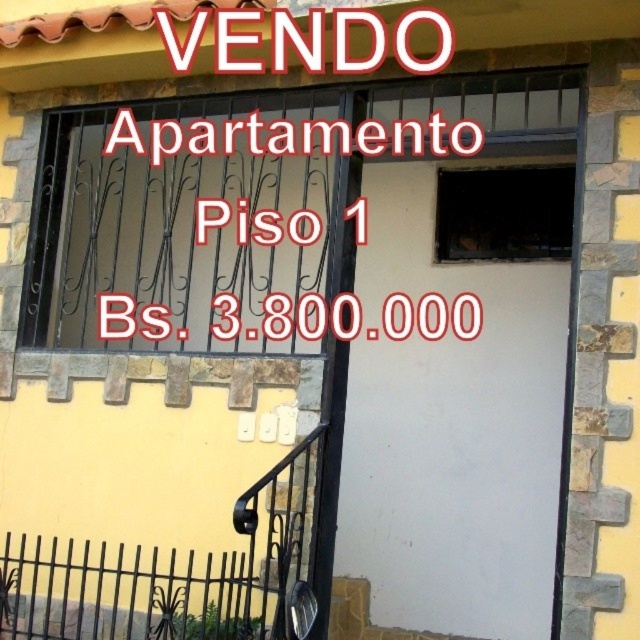
Question: Where is white matte door at center located in relation to white matte sign at upper center in the image?

Choices:
 (A) left
 (B) right

Answer: (B)

Question: Which point is farther to the camera?

Choices:
 (A) (444, 467)
 (B) (262, 60)

Answer: (A)

Question: Is white matte door at center to the left of white matte sign at upper center from the viewer's perspective?

Choices:
 (A) yes
 (B) no

Answer: (B)

Question: Can you confirm if white matte door at center is positioned to the right of white matte sign at upper center?

Choices:
 (A) no
 (B) yes

Answer: (B)

Question: Which object is closer to the camera taking this photo?

Choices:
 (A) white matte door at center
 (B) white matte sign at upper center

Answer: (B)